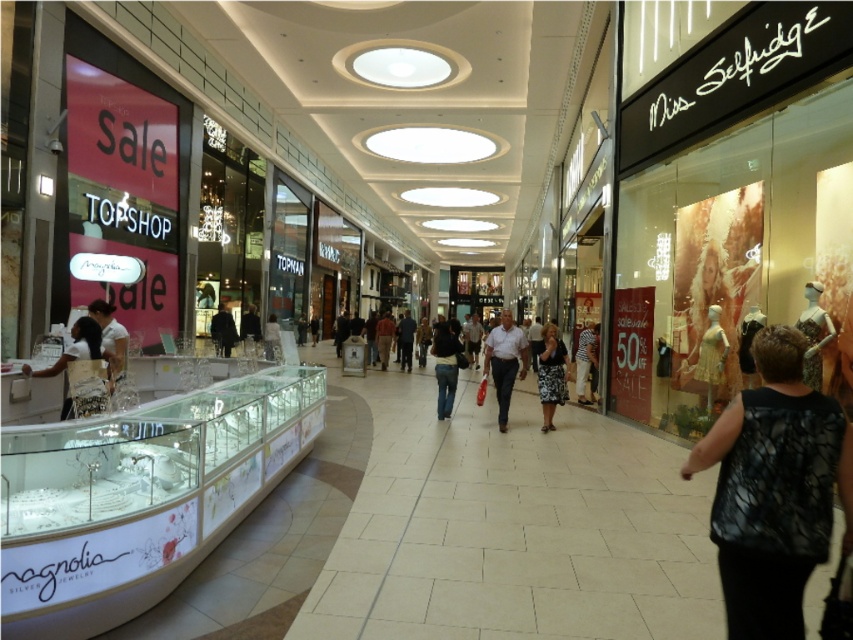
You are a customer in the shopping mall and you see a dark wool coat at center and a dark gray fabric jacket at center. Which one is positioned lower in the display?

The dark wool coat at center is located below the dark gray fabric jacket at center, so it is positioned lower in the display.

You are a customer in the shopping mall and you see the light brown leather pants at center and the striped shirt at center. Which item is taller?

The light brown leather pants at center is taller than the striped shirt at center.

Consider the image. You are a customer in the mall and see both the dark wool coat at center and the dark gray fabric jacket at center. Which one do you think is bigger in size?

The dark wool coat at center is larger in size than the dark gray fabric jacket at center.